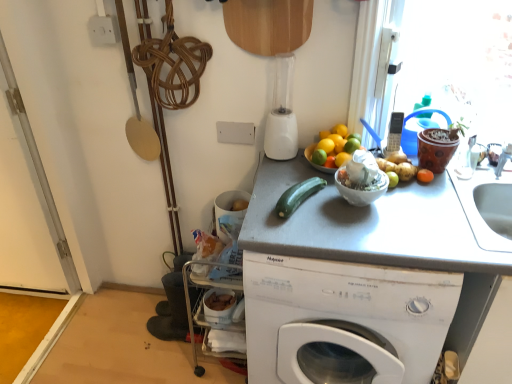
Where is `free space on the front side of orange matte at upper right, the 2th orange viewed from the top`? The width and height of the screenshot is (512, 384). free space on the front side of orange matte at upper right, the 2th orange viewed from the top is located at coordinates (338, 198).